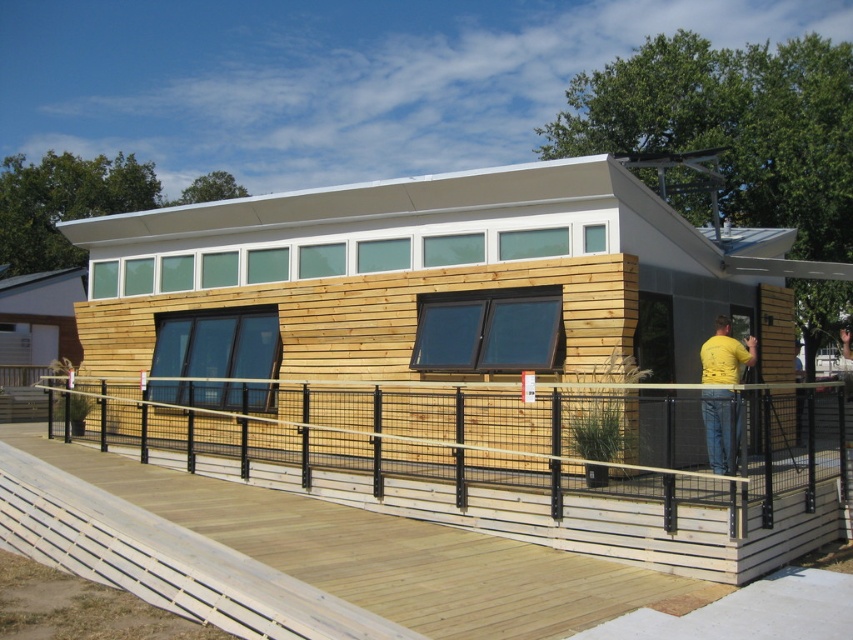
Question: Among these objects, which one is farthest from the camera?

Choices:
 (A) yellow matte shirt at upper right
 (B) wooden slats at lower center

Answer: (A)

Question: Which point is closer to the camera?

Choices:
 (A) wooden slats at lower center
 (B) yellow matte shirt at upper right

Answer: (A)

Question: Where is wooden slats at lower center located in relation to yellow matte shirt at upper right in the image?

Choices:
 (A) right
 (B) left

Answer: (B)

Question: Can you confirm if wooden slats at lower center is bigger than yellow matte shirt at upper right?

Choices:
 (A) no
 (B) yes

Answer: (B)

Question: Can you confirm if wooden slats at lower center is bigger than yellow matte shirt at upper right?

Choices:
 (A) no
 (B) yes

Answer: (B)